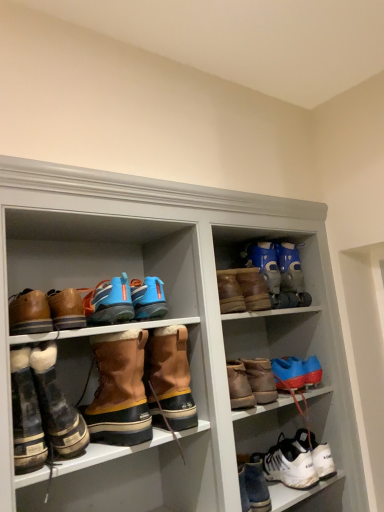
This screenshot has width=384, height=512. Find the location of `white fur-lined boots at lower left, the twelfth footwear positioned from the right`. white fur-lined boots at lower left, the twelfth footwear positioned from the right is located at coordinates (26, 415).

How much space does white fur-lined boots at lower left, the twelfth footwear positioned from the right, occupy vertically?

white fur-lined boots at lower left, the twelfth footwear positioned from the right, is 10.23 inches in height.

In order to click on brown suede boots at lower left, the 4th footwear in the left-to-right sequence in this screenshot , I will do `click(57, 406)`.

Is leather boots at left, positioned as the thirteenth footwear in right-to-left order, not inside blue synthetic running shoes at center, acting as the 9th footwear starting from the right?

Yes, leather boots at left, positioned as the thirteenth footwear in right-to-left order, is not within blue synthetic running shoes at center, acting as the 9th footwear starting from the right.

Between leather boots at left, which ranks as the 1th footwear in left-to-right order, and blue synthetic running shoes at center, which ranks as the 5th footwear in left-to-right order, which one has larger width?

blue synthetic running shoes at center, which ranks as the 5th footwear in left-to-right order.

Could you tell me if leather boots at left, which ranks as the 1th footwear in left-to-right order, is facing blue synthetic running shoes at center, acting as the 9th footwear starting from the right?

No, leather boots at left, which ranks as the 1th footwear in left-to-right order, is not turned towards blue synthetic running shoes at center, acting as the 9th footwear starting from the right.

Is leather boots at left, which ranks as the 1th footwear in left-to-right order, in front of blue synthetic running shoes at center, acting as the 9th footwear starting from the right?

Yes, leather boots at left, which ranks as the 1th footwear in left-to-right order, is in front of blue synthetic running shoes at center, acting as the 9th footwear starting from the right.

Who is taller, blue synthetic running shoes at center, acting as the 9th footwear starting from the right, or blue synthetic ski boots at upper right, the eleventh footwear in the left-to-right sequence?

Standing taller between the two is blue synthetic ski boots at upper right, the eleventh footwear in the left-to-right sequence.

From the image's perspective, between blue synthetic running shoes at center, which ranks as the 5th footwear in left-to-right order, and blue synthetic ski boots at upper right, the eleventh footwear in the left-to-right sequence, who is located below?

blue synthetic running shoes at center, which ranks as the 5th footwear in left-to-right order, is shown below in the image.

Does blue synthetic running shoes at center, acting as the 9th footwear starting from the right, have a larger size compared to blue synthetic ski boots at upper right, the eleventh footwear in the left-to-right sequence?

No.

Based on the photo, is blue synthetic running shoes at center, acting as the 9th footwear starting from the right, positioned before blue synthetic ski boots at upper right, which is counted as the third footwear, starting from the right?

That is True.

Is white fur-lined boots at lower left, the 2th footwear when ordered from left to right, further to camera compared to white leather sneakers at lower right, which appears as the thirteenth footwear when viewed from the left?

No, it is in front of white leather sneakers at lower right, which appears as the thirteenth footwear when viewed from the left.

Locate an element on the screen. This screenshot has height=512, width=384. the 4th footwear positioned above the white leather sneakers at lower right, which is the 1th footwear from right to left (from a real-world perspective) is located at coordinates (26, 415).

From a real-world perspective, which object stands above the other?

white fur-lined boots at lower left, the 2th footwear when ordered from left to right, from a real-world perspective.

Which is farther from the camera, (31, 460) or (330, 456)?

The point (330, 456) is farther.

Between white leather sneakers at lower right, the tenth footwear in the left-to-right sequence, and white leather sneakers at lower right, which appears as the thirteenth footwear when viewed from the left, which one is positioned in front?

white leather sneakers at lower right, the tenth footwear in the left-to-right sequence, is in front.

Between white leather sneakers at lower right, the tenth footwear in the left-to-right sequence, and white leather sneakers at lower right, which appears as the thirteenth footwear when viewed from the left, which one appears on the right side from the viewer's perspective?

white leather sneakers at lower right, which appears as the thirteenth footwear when viewed from the left, is more to the right.

Consider the image. Is white leather sneakers at lower right, acting as the fourth footwear starting from the right, beside white leather sneakers at lower right, which is the 1th footwear from right to left?

Yes, white leather sneakers at lower right, acting as the fourth footwear starting from the right, is touching white leather sneakers at lower right, which is the 1th footwear from right to left.

Is brown suede boots at center, arranged as the 6th footwear when viewed from the left, far away from brown suede boots at upper right, which is the ninth footwear in left-to-right order?

They are positioned close to each other.

Considering the points (124, 435) and (222, 285), which point is behind, point (124, 435) or point (222, 285)?

The point (222, 285) is farther from the camera.

Does brown suede boots at center, the 8th footwear from the right, have a larger size compared to brown suede boots at upper right, placed as the fifth footwear when sorted from right to left?

Yes, brown suede boots at center, the 8th footwear from the right, is bigger than brown suede boots at upper right, placed as the fifth footwear when sorted from right to left.

Is brown suede boots at center, the 8th footwear from the right, situated inside brown suede boots at upper right, which is the ninth footwear in left-to-right order, or outside?

brown suede boots at center, the 8th footwear from the right, lies outside brown suede boots at upper right, which is the ninth footwear in left-to-right order.

Is the surface of brown suede boots at center, the 7th footwear viewed from the right, in direct contact with blue synthetic ski boots at upper right, which is counted as the third footwear, starting from the right?

No, brown suede boots at center, the 7th footwear viewed from the right, is not in contact with blue synthetic ski boots at upper right, which is counted as the third footwear, starting from the right.

How different are the orientations of brown suede boots at center, acting as the 7th footwear starting from the left, and blue synthetic ski boots at upper right, which is counted as the third footwear, starting from the right, in degrees?

11 degrees separate the facing orientations of brown suede boots at center, acting as the 7th footwear starting from the left, and blue synthetic ski boots at upper right, which is counted as the third footwear, starting from the right.

Considering the sizes of objects brown suede boots at center, acting as the 7th footwear starting from the left, and blue synthetic ski boots at upper right, which is counted as the third footwear, starting from the right, in the image provided, who is shorter, brown suede boots at center, acting as the 7th footwear starting from the left, or blue synthetic ski boots at upper right, which is counted as the third footwear, starting from the right,?

Standing shorter between the two is blue synthetic ski boots at upper right, which is counted as the third footwear, starting from the right.

Between point (146, 384) and point (299, 289), which one is positioned behind?

The point (299, 289) is farther from the camera.

In the image, is brown leather boots at left, which is the eleventh footwear from right to left, positioned in front of or behind white leather sneakers at lower right, the tenth footwear in the left-to-right sequence?

brown leather boots at left, which is the eleventh footwear from right to left, is in front of white leather sneakers at lower right, the tenth footwear in the left-to-right sequence.

Considering the relative sizes of brown leather boots at left, which is the eleventh footwear from right to left, and white leather sneakers at lower right, acting as the fourth footwear starting from the right, in the image provided, is brown leather boots at left, which is the eleventh footwear from right to left, smaller than white leather sneakers at lower right, acting as the fourth footwear starting from the right,?

Yes.

This screenshot has width=384, height=512. Find the location of `the 6th footwear in front of the white leather sneakers at lower right, acting as the fourth footwear starting from the right, starting your count from the anchor`. the 6th footwear in front of the white leather sneakers at lower right, acting as the fourth footwear starting from the right, starting your count from the anchor is located at coordinates (66, 309).

From the image's perspective, is brown leather boots at left, acting as the third footwear starting from the left, located beneath white leather sneakers at lower right, the tenth footwear in the left-to-right sequence?

No.

From the image's perspective, which footwear is the 1st one below the blue synthetic running shoes at center, which ranks as the 5th footwear in left-to-right order? Please provide its 2D coordinates.

[(29, 313)]

The image size is (384, 512). In order to click on the 7th footwear behind the blue synthetic running shoes at center, which ranks as the 5th footwear in left-to-right order in this screenshot , I will do `click(279, 272)`.

Considering their positions, is brown suede boots at center, arranged as the 6th footwear when viewed from the left, positioned further to blue synthetic ski boots at upper right, which is counted as the third footwear, starting from the right, than white leather sneakers at lower right, the tenth footwear in the left-to-right sequence?

Based on the image, brown suede boots at center, arranged as the 6th footwear when viewed from the left, appears to be further to blue synthetic ski boots at upper right, which is counted as the third footwear, starting from the right.

Based on their spatial positions, is blue synthetic running shoes at center, acting as the 9th footwear starting from the right, or white leather sneakers at lower right, which appears as the thirteenth footwear when viewed from the left, closer to blue matte boot at upper right, positioned as the twelfth footwear in left-to-right order?

white leather sneakers at lower right, which appears as the thirteenth footwear when viewed from the left, is positioned closer to the anchor blue matte boot at upper right, positioned as the twelfth footwear in left-to-right order.

Looking at the image, which one is located closer to white leather sneakers at lower right, which is the 1th footwear from right to left, brown suede boots at center, the 8th footwear from the right, or white leather sneakers at lower right, acting as the fourth footwear starting from the right?

Among the two, white leather sneakers at lower right, acting as the fourth footwear starting from the right, is located nearer to white leather sneakers at lower right, which is the 1th footwear from right to left.

Considering their positions, is white leather sneakers at lower right, which is the 1th footwear from right to left, positioned further to brown suede boots at center, the 7th footwear viewed from the right, than blue synthetic ski boots at upper right, which is counted as the third footwear, starting from the right?

white leather sneakers at lower right, which is the 1th footwear from right to left.

Estimate the real-world distances between objects in this image. Which object is closer to blue synthetic ski boots at upper right, the eleventh footwear in the left-to-right sequence, leather boots at left, positioned as the thirteenth footwear in right-to-left order, or blue matte boot at upper right, the 2th footwear when ordered from right to left?

blue matte boot at upper right, the 2th footwear when ordered from right to left.

When comparing their distances from leather boots at left, which ranks as the 1th footwear in left-to-right order, does brown leather boots at left, acting as the third footwear starting from the left, or white leather sneakers at lower right, acting as the fourth footwear starting from the right, seem further?

Among the two, white leather sneakers at lower right, acting as the fourth footwear starting from the right, is located further to leather boots at left, which ranks as the 1th footwear in left-to-right order.

Looking at the image, which one is located further to brown leather boots at left, which is the eleventh footwear from right to left, blue synthetic ski boots at upper right, which is counted as the third footwear, starting from the right, or brown suede boots at upper right, which is the ninth footwear in left-to-right order?

Among the two, blue synthetic ski boots at upper right, which is counted as the third footwear, starting from the right, is located further to brown leather boots at left, which is the eleventh footwear from right to left.

Considering their positions, is leather boots at left, positioned as the thirteenth footwear in right-to-left order, positioned closer to blue matte boot at upper right, positioned as the twelfth footwear in left-to-right order, than blue synthetic ski boots at upper right, which is counted as the third footwear, starting from the right?

blue synthetic ski boots at upper right, which is counted as the third footwear, starting from the right.

Where is `footwear located between brown suede boots at center, arranged as the 6th footwear when viewed from the left, and leather boots at center, which is counted as the eighth footwear, starting from the left, in the left-right direction`? The width and height of the screenshot is (384, 512). footwear located between brown suede boots at center, arranged as the 6th footwear when viewed from the left, and leather boots at center, which is counted as the eighth footwear, starting from the left, in the left-right direction is located at coordinates (169, 379).

Locate an element on the screen. Image resolution: width=384 pixels, height=512 pixels. footwear between brown leather boots at left, acting as the third footwear starting from the left, and brown suede boots at center, arranged as the 6th footwear when viewed from the left, from top to bottom is located at coordinates (26, 415).

In order to click on footwear between leather boots at left, positioned as the thirteenth footwear in right-to-left order, and white fur-lined boots at lower left, the twelfth footwear positioned from the right, in the vertical direction in this screenshot , I will do pyautogui.click(x=66, y=309).

Locate an element on the screen. This screenshot has width=384, height=512. footwear between leather boots at center, which is counted as the eighth footwear, starting from the left, and white leather sneakers at lower right, acting as the fourth footwear starting from the right, in the up-down direction is located at coordinates (297, 371).